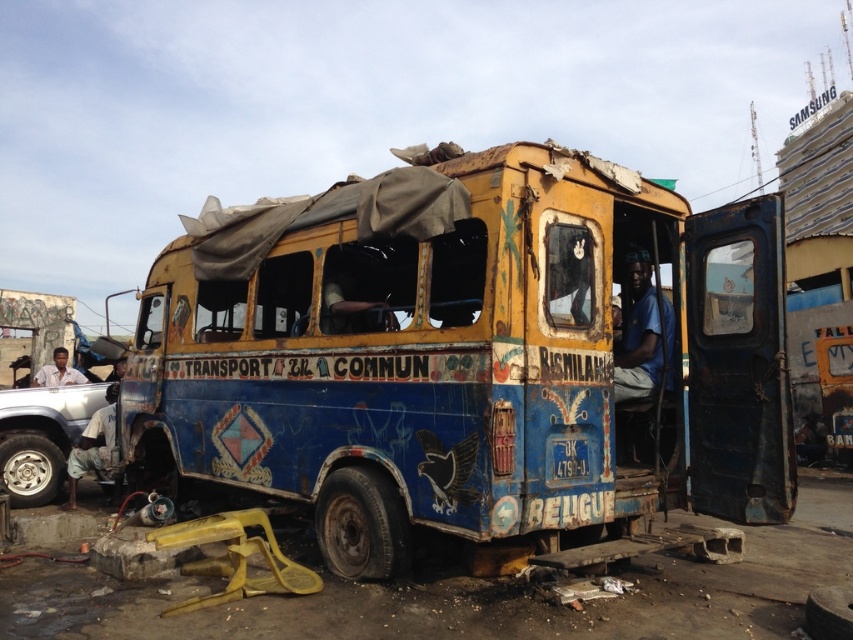
Can you confirm if rusty metal bus at center is smaller than silver metallic car at lower left?

Indeed, rusty metal bus at center has a smaller size compared to silver metallic car at lower left.

Does rusty metal bus at center have a greater height compared to silver metallic car at lower left?

In fact, rusty metal bus at center may be shorter than silver metallic car at lower left.

Which is in front, point (723, 252) or point (19, 508)?

Point (723, 252) is more forward.

At what (x,y) coordinates should I click in order to perform the action: click on rusty metal bus at center. Please return your answer as a coordinate pair (x, y). The image size is (853, 640). Looking at the image, I should click on (473, 355).